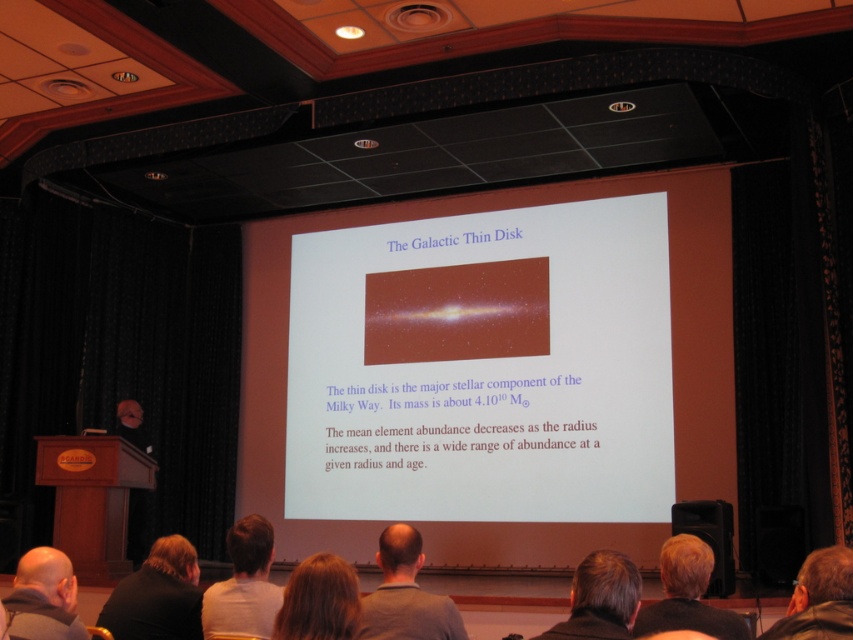
Consider the image. You are an event organizer who needs to place a 30 cm wide decorative stand between the blonde hair at lower right and the leather jacket at lower right. Can the stand fit between them?

The distance between the blonde hair at lower right and the leather jacket at lower right is 31.11 centimeters. Since the stand is 30 cm wide, it can fit between them as there is enough space.

You are an attendee sitting in the front row of the conference room. You notice two points on the projection screen. The first point is located at coordinates point (697,556) and the second at point (827,621). Which point appears closer to you?

Point (697,556) is further to the viewer than point (827,621), so the first point appears closer to you.